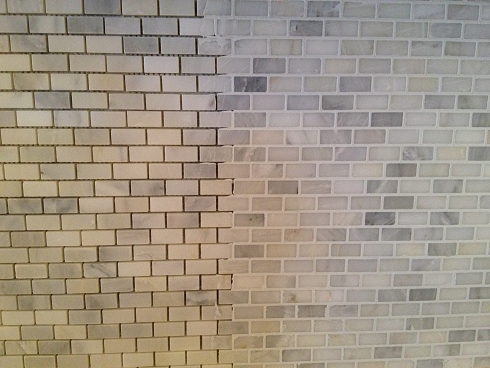
Locate an element on the screen. dirty grout is located at coordinates (218, 314), (216, 37), (222, 281).